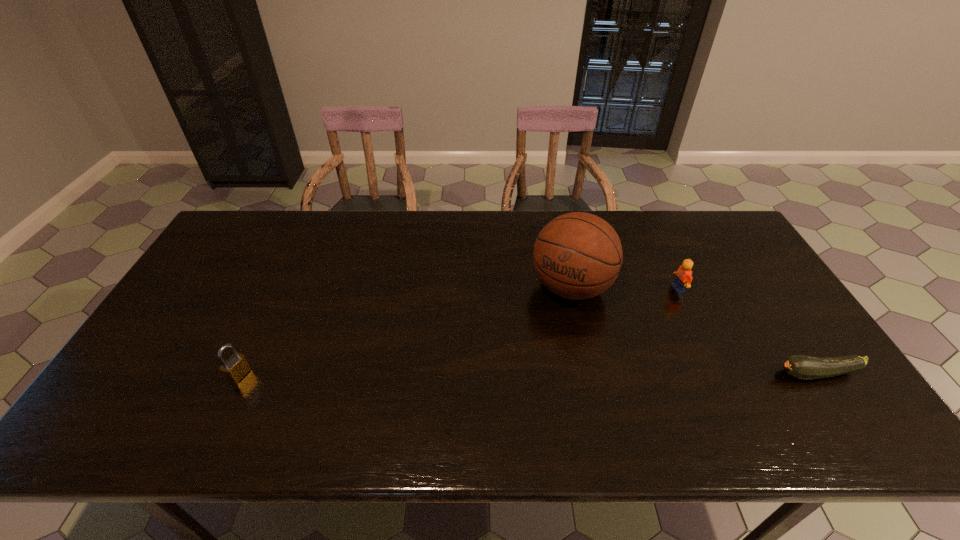
Where is `vacant spot on the desktop that is between the leftmost object and the zucchini and is positioned on the side with brand label of the basketball`? vacant spot on the desktop that is between the leftmost object and the zucchini and is positioned on the side with brand label of the basketball is located at coordinates (514, 374).

Image resolution: width=960 pixels, height=540 pixels. Identify the location of vacant space on the desktop that is between the padlock and the shortest object and is positioned on the front-facing side of the third object from left to right. (539, 374).